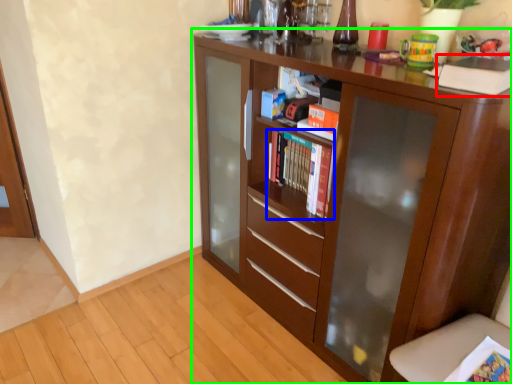
Question: Estimate the real-world distances between objects in this image. Which object is farther from paperback book (highlighted by a red box), book (highlighted by a blue box) or cupboard (highlighted by a green box)?

Choices:
 (A) book
 (B) cupboard

Answer: (B)